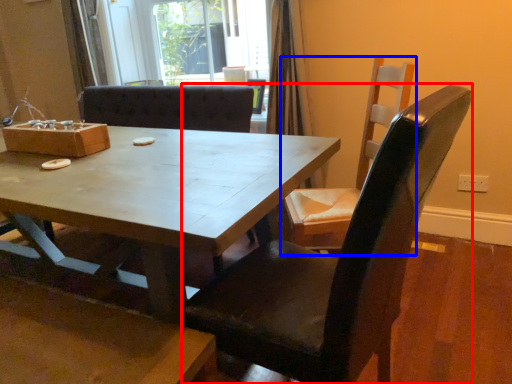
Question: Which object is closer to the camera taking this photo, chair (highlighted by a red box) or chair (highlighted by a blue box)?

Choices:
 (A) chair
 (B) chair

Answer: (A)